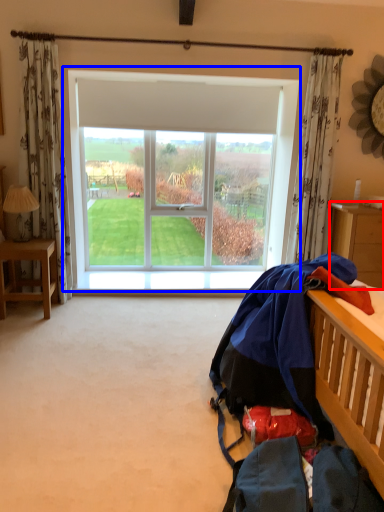
Question: Among these objects, which one is nearest to the camera, nightstand (highlighted by a red box) or window (highlighted by a blue box)?

Choices:
 (A) nightstand
 (B) window

Answer: (A)